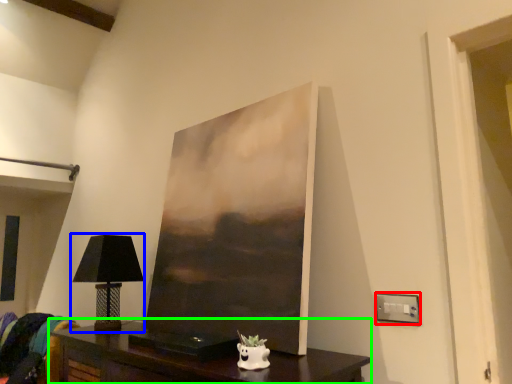
Question: Which object is the farthest from electric outlet (highlighted by a red box)? Choose among these: table lamp (highlighted by a blue box) or table (highlighted by a green box).

Choices:
 (A) table lamp
 (B) table

Answer: (A)